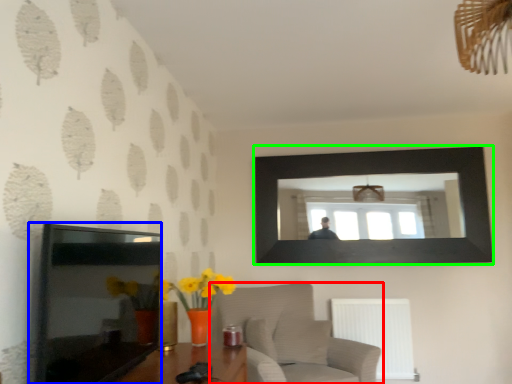
Question: Which is nearer to the furniture (highlighted by a red box)? picture frame (highlighted by a blue box) or picture frame (highlighted by a green box).

Choices:
 (A) picture frame
 (B) picture frame

Answer: (B)